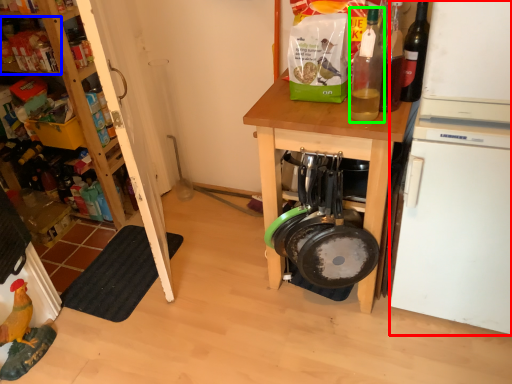
Question: Which is nearer to the appliance (highlighted by a red box)? shelf (highlighted by a blue box) or bottle (highlighted by a green box).

Choices:
 (A) shelf
 (B) bottle

Answer: (B)